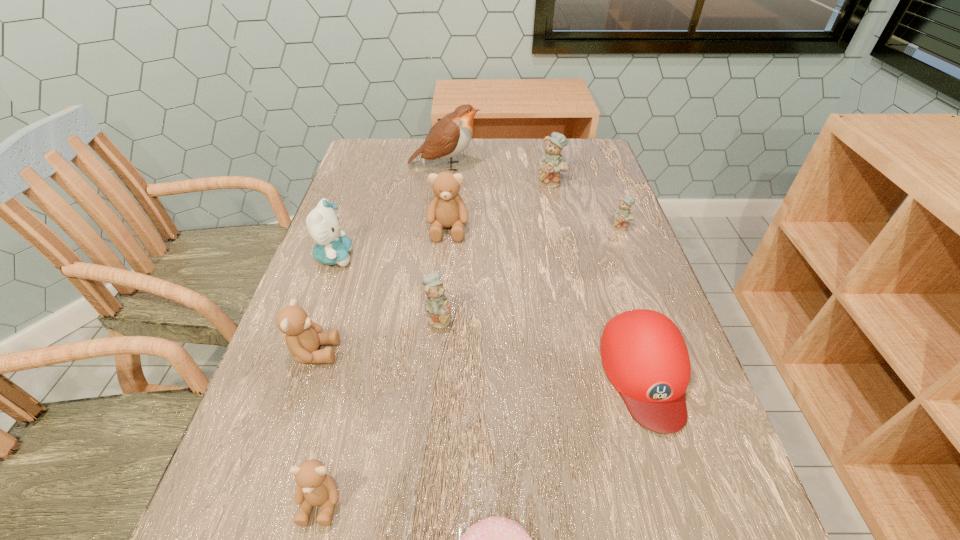
Where is `the second biggest brown teddy bear`? Image resolution: width=960 pixels, height=540 pixels. the second biggest brown teddy bear is located at coordinates (303, 337).

Locate an element on the screen. This screenshot has height=540, width=960. baseball cap is located at coordinates (644, 355).

Find the location of a particular element. This screenshot has width=960, height=540. the rightmost teddy bear is located at coordinates (623, 214).

Image resolution: width=960 pixels, height=540 pixels. What are the coordinates of `the rightmost blue teddy bear` in the screenshot? It's located at pos(623,214).

Find the location of a particular element. The width and height of the screenshot is (960, 540). the second brown teddy bear from right to left is located at coordinates (315, 487).

Locate an element on the screen. The width and height of the screenshot is (960, 540). the second teddy bear from left to right is located at coordinates (315, 487).

You are a GUI agent. You are given a task and a screenshot of the screen. Output one action in this format:
    pyautogui.click(x=<x>, y=<y>)
    Task: Click on the vacant region located at the face of the brown bird
    The height and width of the screenshot is (540, 960).
    Given the screenshot: What is the action you would take?
    pyautogui.click(x=517, y=166)

At what (x,y) coordinates should I click in order to perform the action: click on free space located 0.080m on the front-facing side of the second teddy bear from right to left. Please return your answer as a coordinate pair (x, y). This screenshot has width=960, height=540. Looking at the image, I should click on (556, 206).

What are the coordinates of `free space located on the front-facing side of the farthest brown teddy bear` in the screenshot? It's located at (441, 315).

Locate an element on the screen. The height and width of the screenshot is (540, 960). vacant space positioned on the face of the kitten is located at coordinates (379, 257).